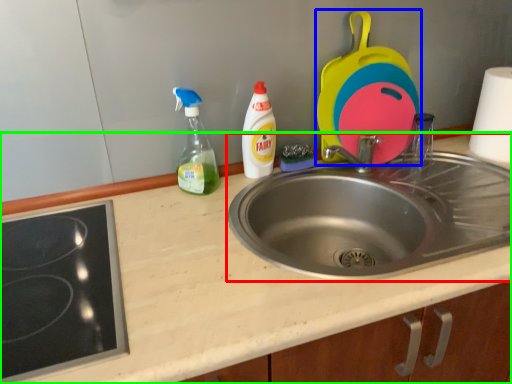
Question: Which is farther away from sink (highlighted by a red box)? appliance (highlighted by a blue box) or counter top (highlighted by a green box)?

Choices:
 (A) appliance
 (B) counter top

Answer: (A)